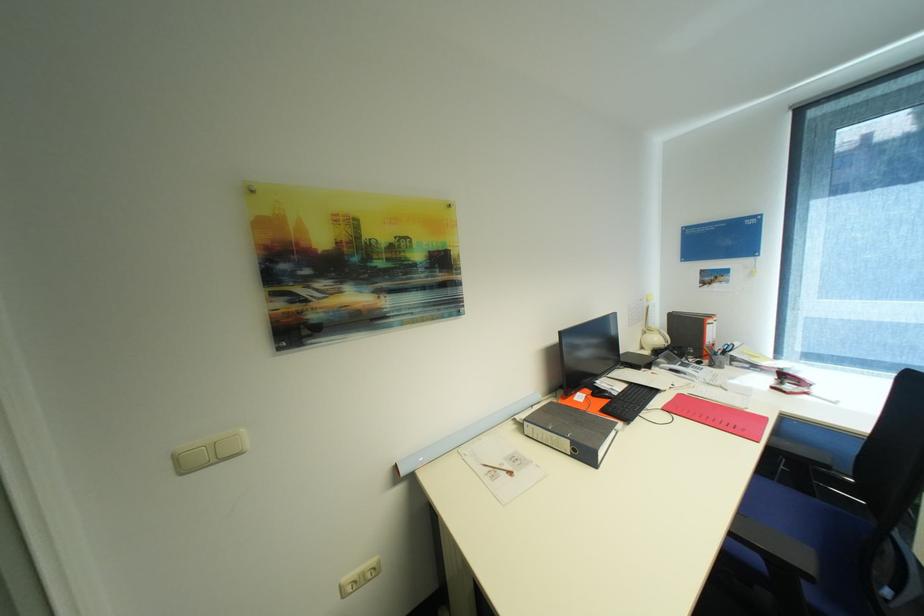
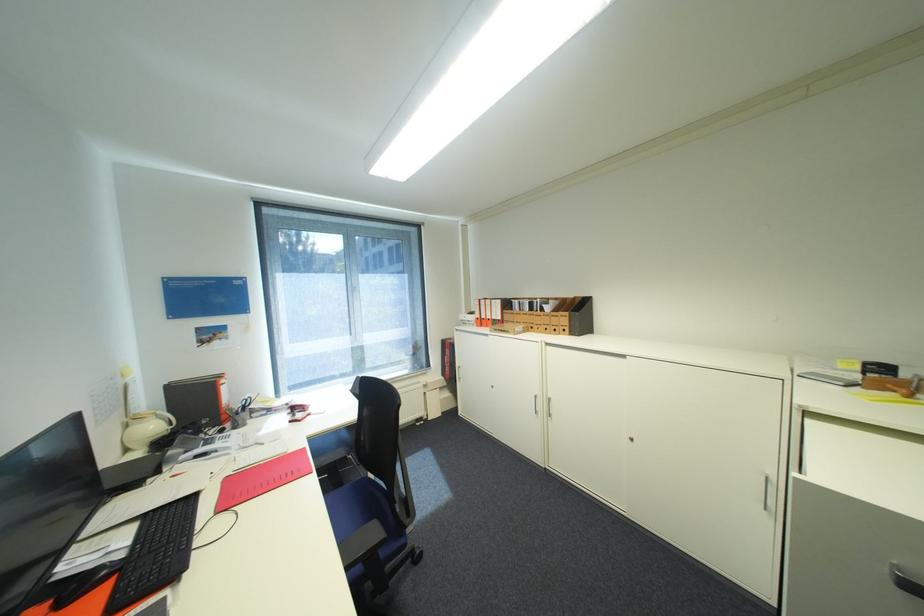
Find the pixel in the second image that matches point 725,347 in the first image.

(246, 406)